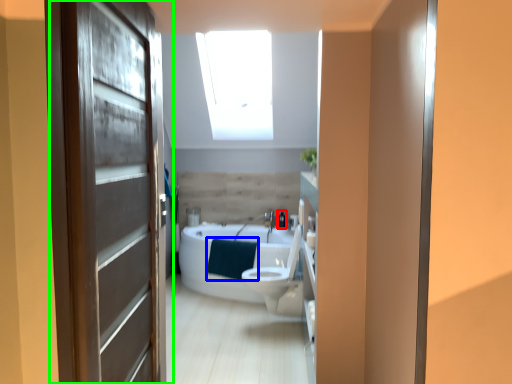
Question: Which is farther away from toiletry (highlighted by a red box)? blanket (highlighted by a blue box) or door (highlighted by a green box)?

Choices:
 (A) blanket
 (B) door

Answer: (B)